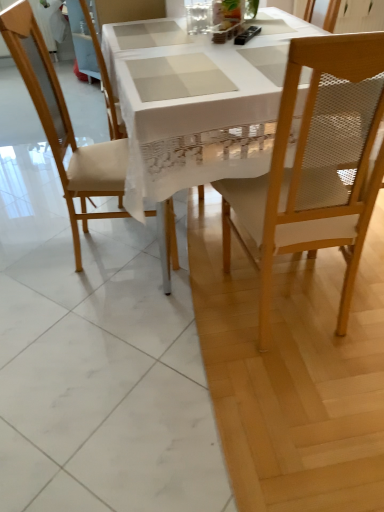
Image resolution: width=384 pixels, height=512 pixels. I want to click on blank space to the left of light wood mesh chair at right, which is the first chair in right-to-left order, so click(x=182, y=313).